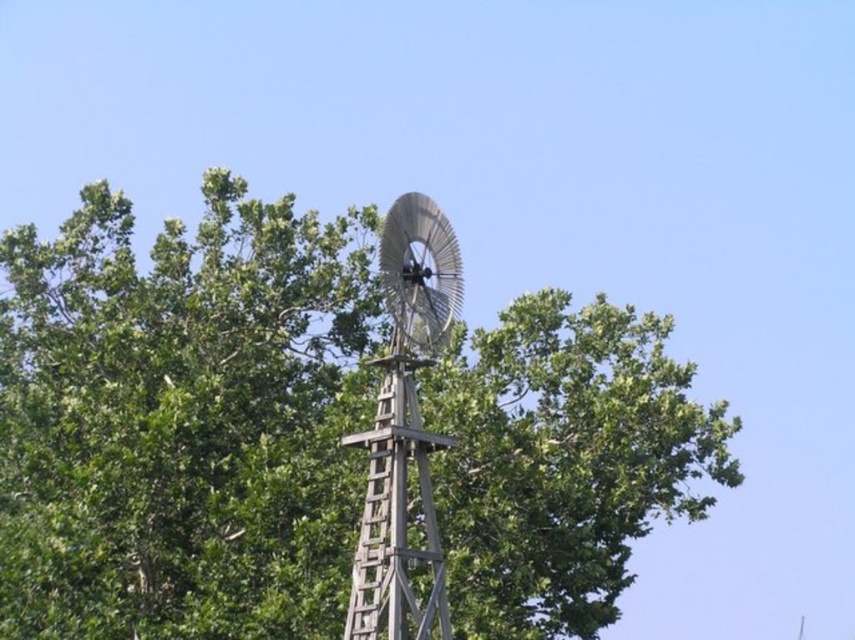
Question: Is green leafy tree at center positioned behind wooden windmill at center?

Choices:
 (A) yes
 (B) no

Answer: (A)

Question: Can you confirm if green leafy tree at center is smaller than wooden windmill at center?

Choices:
 (A) yes
 (B) no

Answer: (B)

Question: Can you confirm if green leafy tree at center is positioned below wooden windmill at center?

Choices:
 (A) no
 (B) yes

Answer: (A)

Question: Which object is farther from the camera taking this photo?

Choices:
 (A) green leafy tree at center
 (B) wooden windmill at center

Answer: (A)